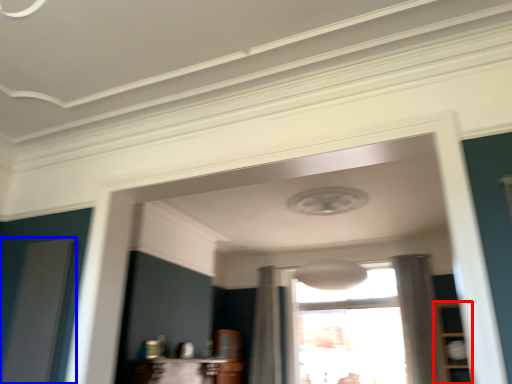
Question: Which object is further to the camera taking this photo, cabinetry (highlighted by a red box) or screen door (highlighted by a blue box)?

Choices:
 (A) cabinetry
 (B) screen door

Answer: (A)